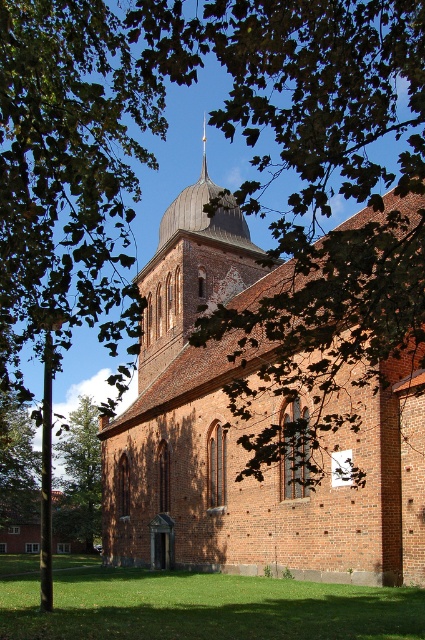
Question: Which point appears closest to the camera in this image?

Choices:
 (A) [x=203, y=140]
 (B) [x=59, y=506]
 (C) [x=226, y=497]

Answer: (C)

Question: Is green leafy tree at lower left thinner than gold/ornate spire at upper center?

Choices:
 (A) yes
 (B) no

Answer: (B)

Question: Which of these objects is positioned closest to the brown brick church at center?

Choices:
 (A) gold/ornate spire at upper center
 (B) green leafy tree at lower left

Answer: (A)

Question: Which is nearer to the green leafy tree at lower left?

Choices:
 (A) brown brick church at center
 (B) gold/ornate spire at upper center

Answer: (A)

Question: Does brown brick church at center come in front of green leafy tree at lower left?

Choices:
 (A) yes
 (B) no

Answer: (A)

Question: In this image, where is brown brick church at center located relative to green leafy tree at lower left?

Choices:
 (A) above
 (B) below

Answer: (A)